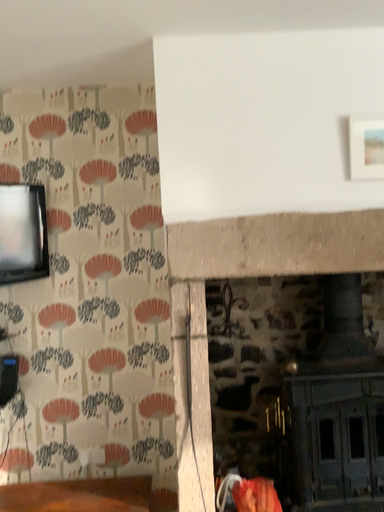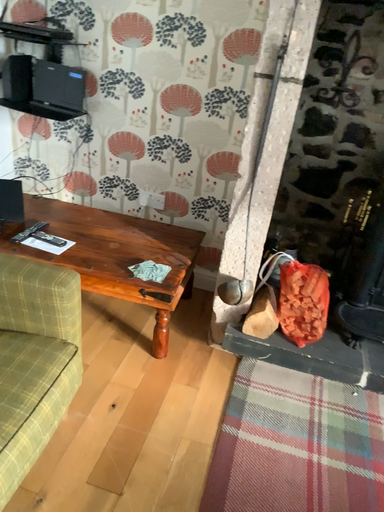
Question: Which way did the camera rotate in the video?

Choices:
 (A) rotated left
 (B) rotated right

Answer: (A)